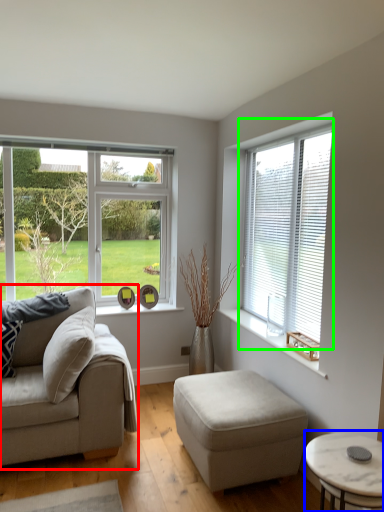
Question: Which object is the farthest from studio couch (highlighted by a red box)? Choose among these: coffee table (highlighted by a blue box) or window (highlighted by a green box).

Choices:
 (A) coffee table
 (B) window

Answer: (B)